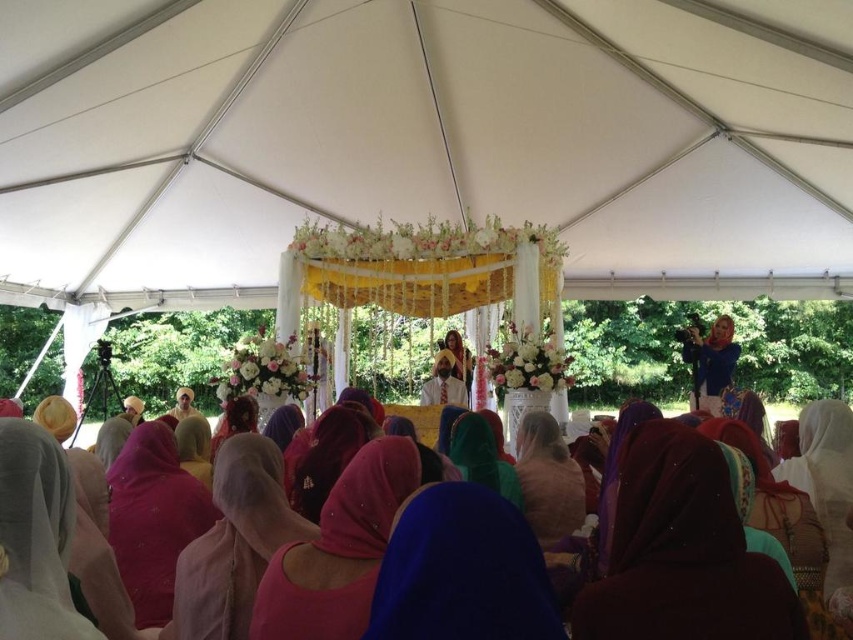
Is pink satin dupatta at center bigger than matte pink veil at center?

Incorrect, pink satin dupatta at center is not larger than matte pink veil at center.

Is point (305, 600) positioned in front of point (537, 513)?

Yes, it is.

Image resolution: width=853 pixels, height=640 pixels. What are the coordinates of `pink satin dupatta at center` in the screenshot? It's located at (338, 550).

Which is more to the right, white fabric canopy at center or purple satin dupatta at center?

Positioned to the right is purple satin dupatta at center.

Between white fabric canopy at center and purple satin dupatta at center, which one has less height?

purple satin dupatta at center

Between point (221, 148) and point (654, 428), which one is positioned in front?

Point (654, 428) is more forward.

Where is `white fabric canopy at center`? white fabric canopy at center is located at coordinates (422, 140).

Is pink satin dupatta at lower center closer to the viewer compared to matte pink headscarf at lower left?

That is False.

Does pink satin dupatta at lower center have a lesser height compared to matte pink headscarf at lower left?

No.

Identify the location of pink satin dupatta at lower center. (234, 541).

Where is `pink satin dupatta at lower center`? The image size is (853, 640). pink satin dupatta at lower center is located at coordinates (234, 541).